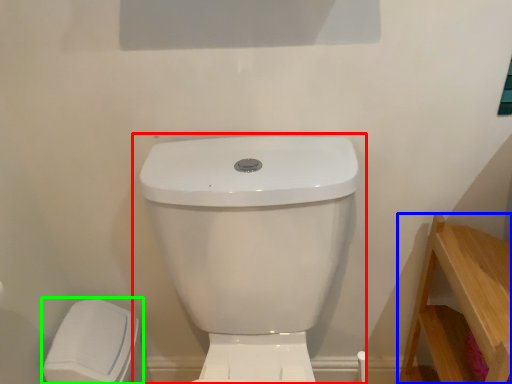
Question: Based on their relative distances, which object is nearer to toilet (highlighted by a red box)? Choose from furniture (highlighted by a blue box) and porcelain (highlighted by a green box).

Choices:
 (A) furniture
 (B) porcelain

Answer: (A)